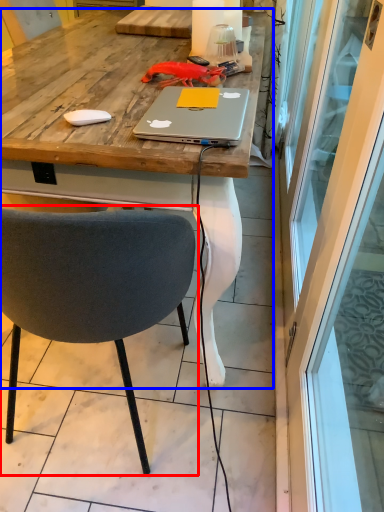
Question: Which object is further to the camera taking this photo, chair (highlighted by a red box) or desk (highlighted by a blue box)?

Choices:
 (A) chair
 (B) desk

Answer: (B)